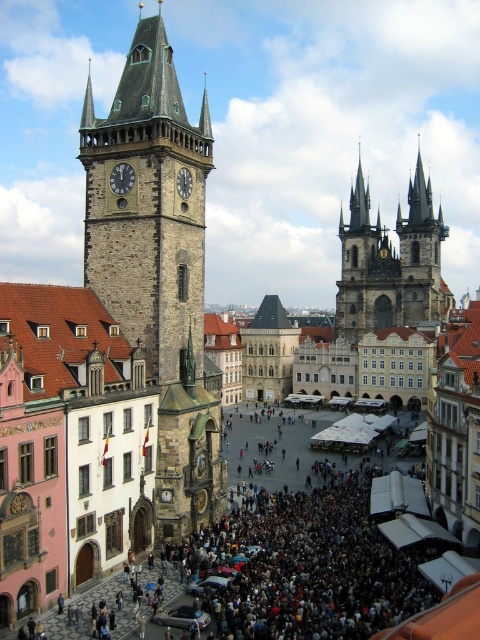
You are standing in the square and want to take a photo of the golden stone spires at upper right. If your camera has a maximum zoom range of 100 meters, will you be able to capture the spires clearly without moving closer?

The golden stone spires at upper right are 174.63 meters away from the viewer. Since the camera can only zoom up to 100 meters, you won cannot capture them clearly without moving closer.

You are a drone operator who needs to fly a drone between the golden stone spires at upper right and the matte stone clock tower at upper left. The drone has a maximum flight distance of 130 meters. Can the drone safely make the trip without needing to recharge?

The golden stone spires at upper right and matte stone clock tower at upper left are 133.67 meters apart from each other. Since the drone can only fly up to 130 meters without recharging, it cannot safely make the trip without needing to recharge.